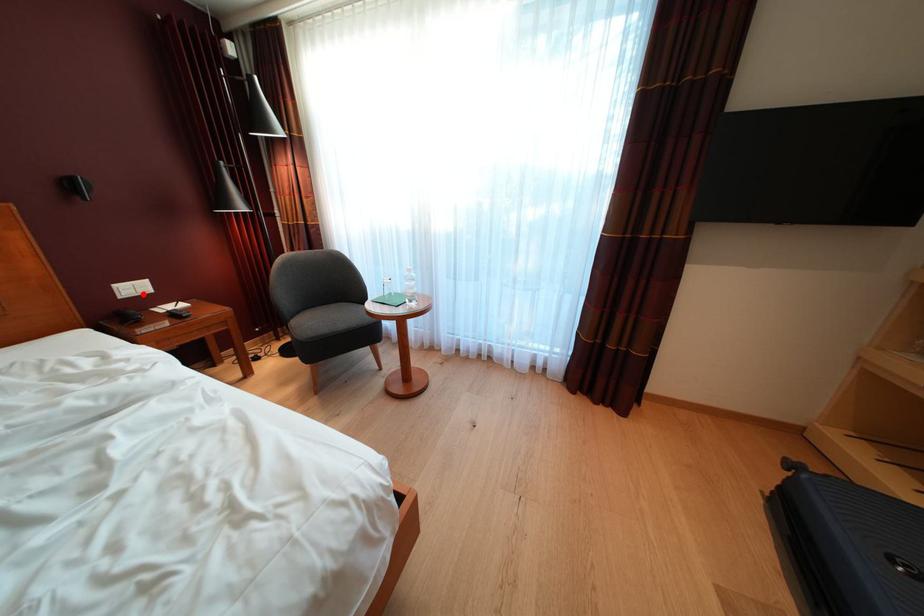
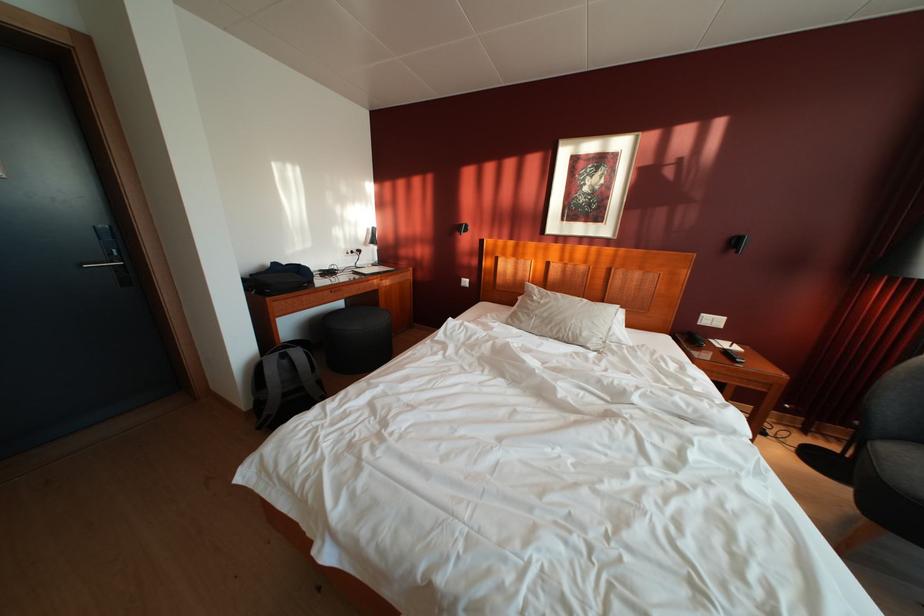
Where in the second image is the point corresponding to the highlighted location from the first image?

(721, 326)